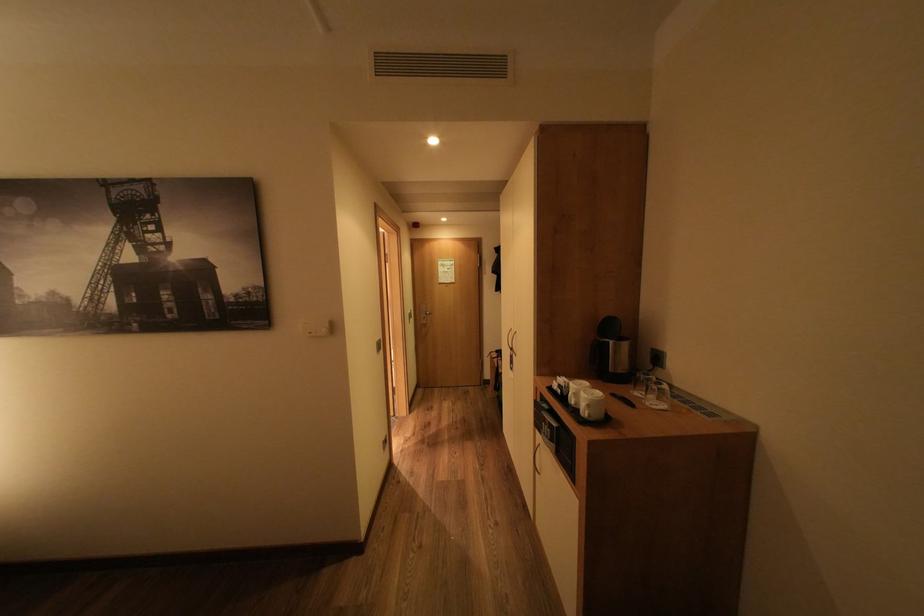
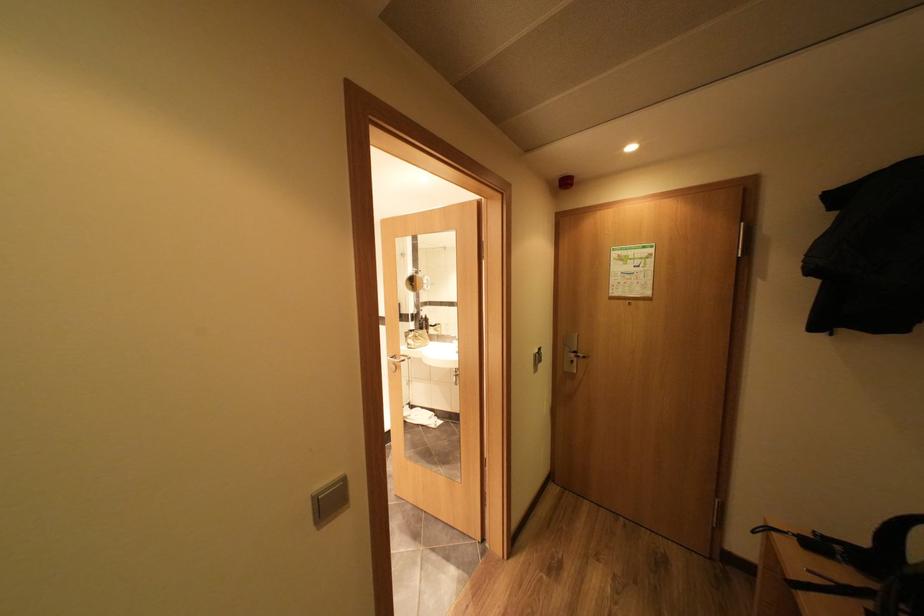
Where in the second image is the point corresponding to point 436,315 from the first image?

(585, 360)